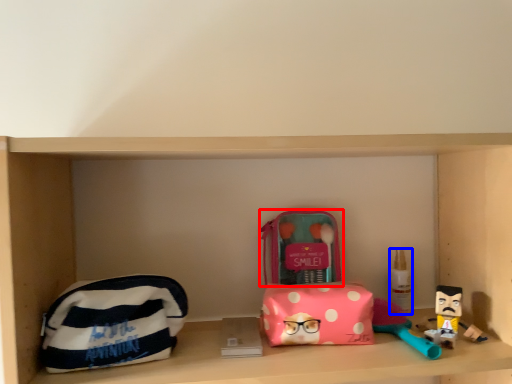
Question: Which of the following is the closest to the observer, kit (highlighted by a red box) or toiletry (highlighted by a blue box)?

Choices:
 (A) kit
 (B) toiletry

Answer: (A)